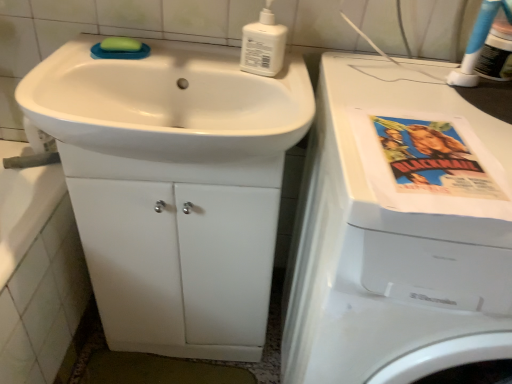
What are the coordinates of `vacant area that lies to the right of green matte soap at upper left` in the screenshot? It's located at (184, 57).